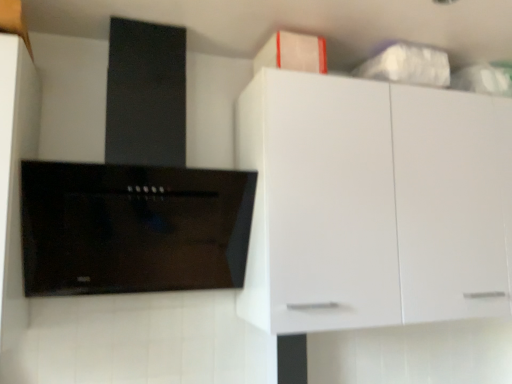
Describe the element at coordinates (374, 203) in the screenshot. I see `white glossy cabinet at upper right` at that location.

You are a GUI agent. You are given a task and a screenshot of the screen. Output one action in this format:
    pyautogui.click(x=<x>, y=<y>)
    Task: Click on the white glossy cabinet at upper right
    The width and height of the screenshot is (512, 384).
    Given the screenshot: What is the action you would take?
    pyautogui.click(x=374, y=203)

The height and width of the screenshot is (384, 512). I want to click on white glossy cabinet at upper right, so click(374, 203).